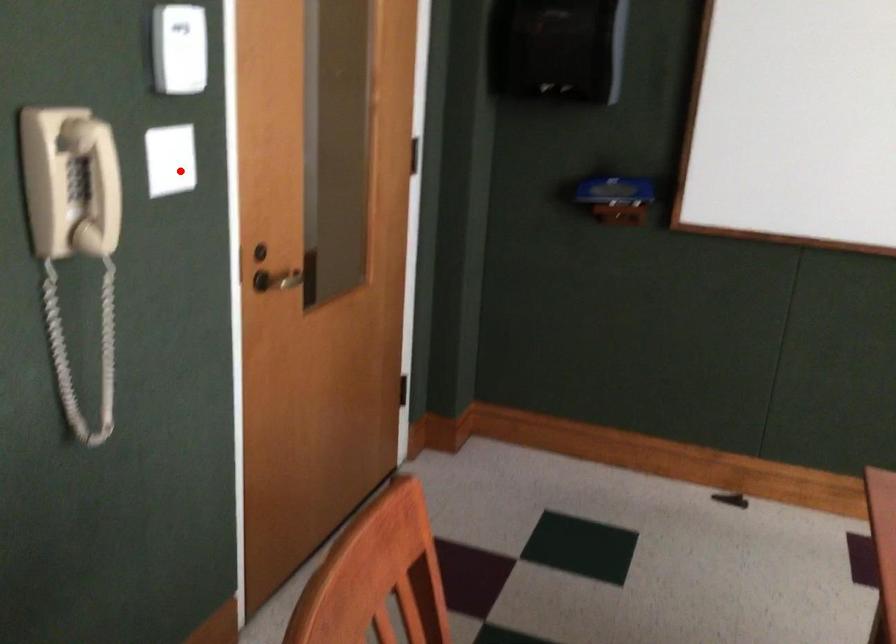
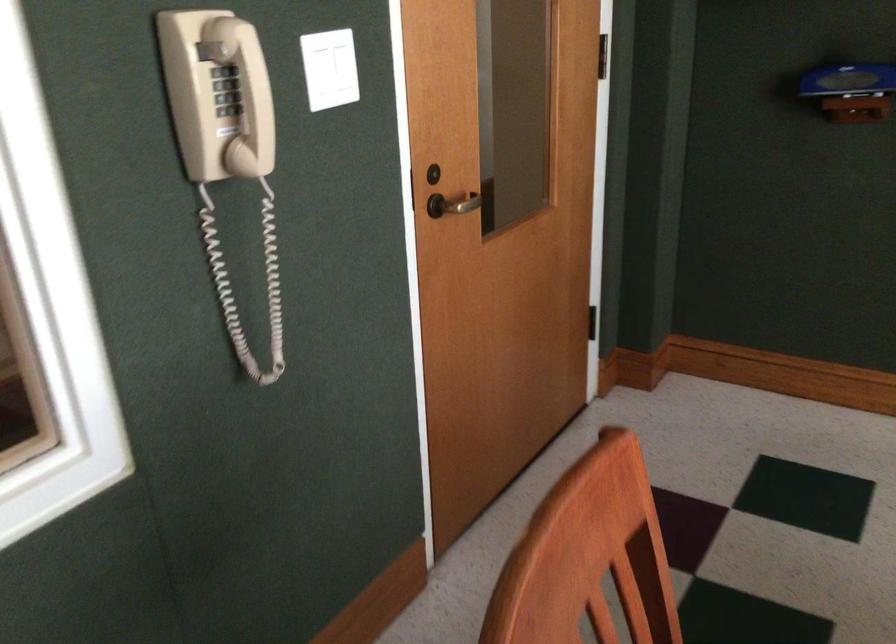
Find the pixel in the second image that matches the highlighted location in the first image.

(330, 69)